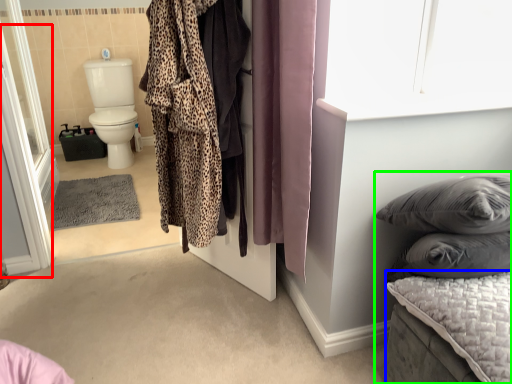
Question: Considering the real-world distances, which object is farthest from screen door (highlighted by a red box)? mattress (highlighted by a blue box) or furniture (highlighted by a green box)?

Choices:
 (A) mattress
 (B) furniture

Answer: (A)